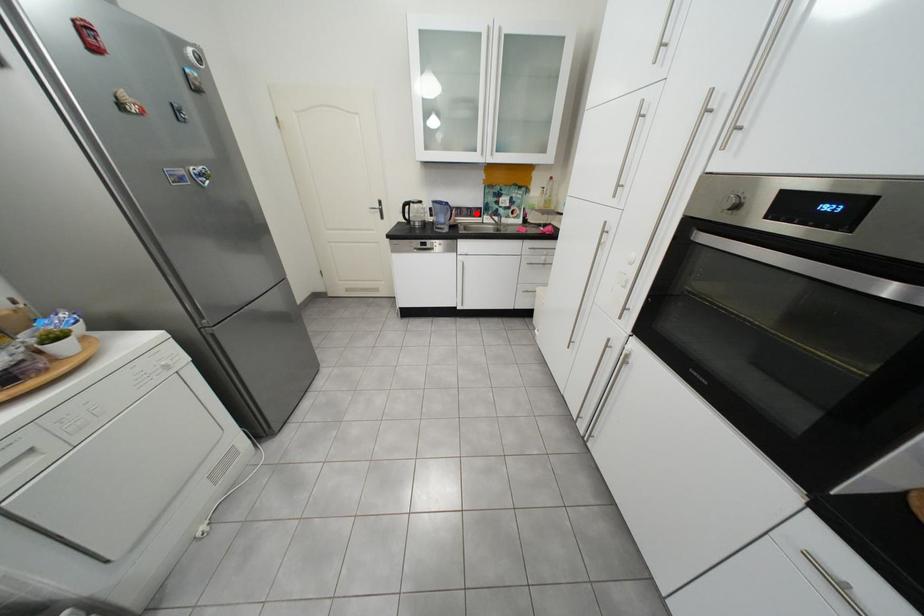
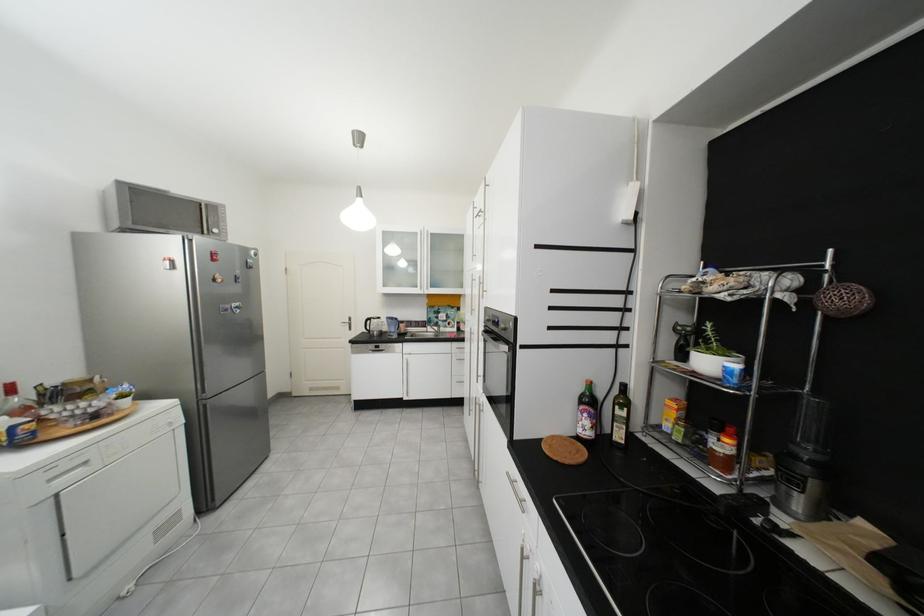
Locate, in the second image, the point that corresponds to the highlighted location in the first image.

(426, 325)